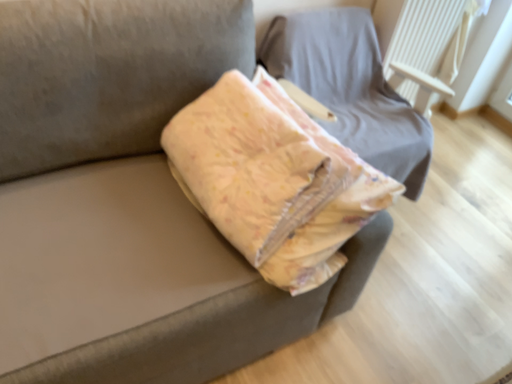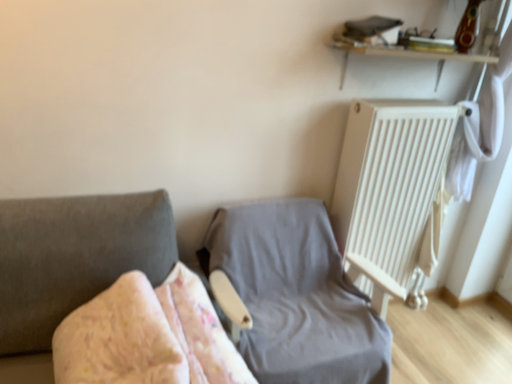
Question: Which way did the camera rotate in the video?

Choices:
 (A) rotated upward
 (B) rotated downward

Answer: (A)